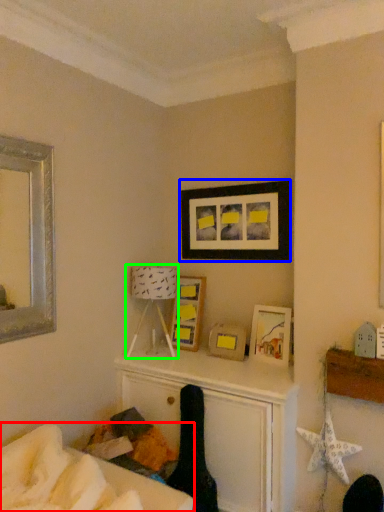
Question: Which object is positioned closest to furniture (highlighted by a red box)? Select from picture frame (highlighted by a blue box) and table lamp (highlighted by a green box).

Choices:
 (A) picture frame
 (B) table lamp

Answer: (B)